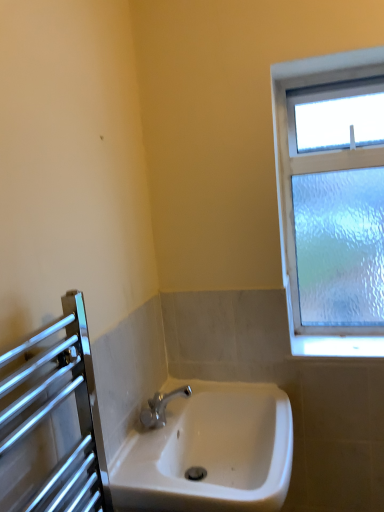
The height and width of the screenshot is (512, 384). What are the coordinates of `white ceramic sink at center` in the screenshot? It's located at (210, 451).

Measure the distance between white ceramic sink at center and camera.

The depth of white ceramic sink at center is 88.48 centimeters.

What do you see at coordinates (210, 451) in the screenshot? I see `white ceramic sink at center` at bounding box center [210, 451].

The height and width of the screenshot is (512, 384). What do you see at coordinates (332, 200) in the screenshot? I see `clear glass window at upper right` at bounding box center [332, 200].

Locate an element on the screen. This screenshot has height=512, width=384. clear glass window at upper right is located at coordinates (332, 200).

Image resolution: width=384 pixels, height=512 pixels. Find the location of `white ceramic sink at center`. white ceramic sink at center is located at coordinates [x=210, y=451].

Considering the positions of objects white ceramic sink at center and clear glass window at upper right in the image provided, who is more to the right, white ceramic sink at center or clear glass window at upper right?

clear glass window at upper right is more to the right.

Considering their positions, is white ceramic sink at center located in front of or behind clear glass window at upper right?

white ceramic sink at center is positioned closer to the viewer than clear glass window at upper right.

Does point (123, 471) lie behind point (289, 247)?

No, (123, 471) is closer to viewer.

From the image's perspective, between white ceramic sink at center and clear glass window at upper right, who is located below?

From the image's view, white ceramic sink at center is below.

From a real-world perspective, which is physically below, white ceramic sink at center or clear glass window at upper right?

white ceramic sink at center is physically lower.

Is white ceramic sink at center thinner than clear glass window at upper right?

In fact, white ceramic sink at center might be wider than clear glass window at upper right.

Can you confirm if white ceramic sink at center is taller than clear glass window at upper right?

Incorrect, the height of white ceramic sink at center is not larger of that of clear glass window at upper right.

Considering the sizes of white ceramic sink at center and clear glass window at upper right in the image, is white ceramic sink at center bigger or smaller than clear glass window at upper right?

white ceramic sink at center is bigger than clear glass window at upper right.

Is white ceramic sink at center not inside clear glass window at upper right?

white ceramic sink at center lies outside clear glass window at upper right's area.

Is white ceramic sink at center next to clear glass window at upper right?

No, white ceramic sink at center is not with clear glass window at upper right.

Could you tell me if white ceramic sink at center is facing clear glass window at upper right?

No, white ceramic sink at center is not oriented towards clear glass window at upper right.

Can you tell me how much white ceramic sink at center and clear glass window at upper right differ in facing direction?

90.3 degrees separate the facing orientations of white ceramic sink at center and clear glass window at upper right.

At what (x,y) coordinates should I click in order to perform the action: click on window that is behind the white ceramic sink at center. Please return your answer as a coordinate pair (x, y). Looking at the image, I should click on (332, 200).

Is clear glass window at upper right to the right of white ceramic sink at center from the viewer's perspective?

Correct, you'll find clear glass window at upper right to the right of white ceramic sink at center.

Which is behind, clear glass window at upper right or white ceramic sink at center?

clear glass window at upper right is more distant.

Is point (367, 122) more distant than point (175, 485)?

Yes, point (367, 122) is farther from viewer.

From the image's perspective, would you say clear glass window at upper right is shown under white ceramic sink at center?

No, from the image's perspective, clear glass window at upper right is not below white ceramic sink at center.

From a real-world perspective, between clear glass window at upper right and white ceramic sink at center, who is vertically higher?

clear glass window at upper right.

Does clear glass window at upper right have a greater width compared to white ceramic sink at center?

No, clear glass window at upper right is not wider than white ceramic sink at center.

Considering the sizes of clear glass window at upper right and white ceramic sink at center in the image, is clear glass window at upper right taller or shorter than white ceramic sink at center?

In the image, clear glass window at upper right appears to be taller than white ceramic sink at center.

Can you confirm if clear glass window at upper right is smaller than white ceramic sink at center?

Yes.

Is clear glass window at upper right completely or partially outside of white ceramic sink at center?

Yes, clear glass window at upper right is outside of white ceramic sink at center.

Can you see clear glass window at upper right touching white ceramic sink at center?

There is a gap between clear glass window at upper right and white ceramic sink at center.

Is clear glass window at upper right looking in the opposite direction of white ceramic sink at center?

No, clear glass window at upper right is not facing the opposite direction of white ceramic sink at center.

How many degrees apart are the facing directions of clear glass window at upper right and white ceramic sink at center?

The angular difference between clear glass window at upper right and white ceramic sink at center is 90.3 degrees.

Identify the location of sink directly beneath the clear glass window at upper right (from a real-world perspective). (210, 451).

Where is `window above the white ceramic sink at center (from the image's perspective)`? The image size is (384, 512). window above the white ceramic sink at center (from the image's perspective) is located at coordinates (332, 200).

Locate an element on the screen. Image resolution: width=384 pixels, height=512 pixels. window located behind the white ceramic sink at center is located at coordinates (332, 200).